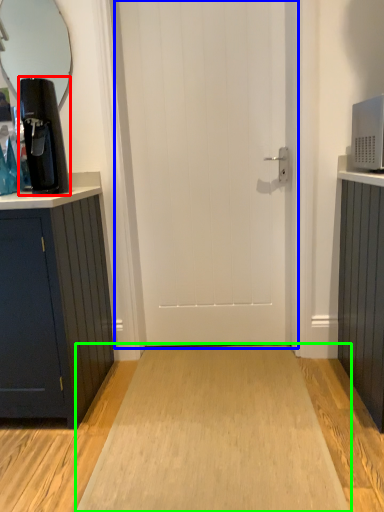
Question: Which object is positioned closest to coffee machine (highlighted by a red box)? Select from door (highlighted by a blue box) and plain (highlighted by a green box).

Choices:
 (A) door
 (B) plain

Answer: (A)